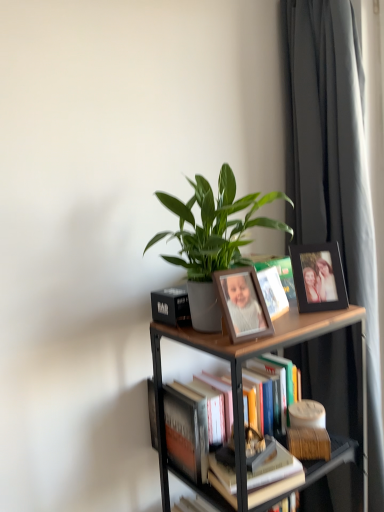
Question: From the image's perspective, is wooden photo frame at center, which appears as the 2th picture frame when viewed from the back, above green matte plant at center?

Choices:
 (A) yes
 (B) no

Answer: (B)

Question: From a real-world perspective, is wooden photo frame at center, which is the second picture frame from right to left, positioned under green matte plant at center based on gravity?

Choices:
 (A) no
 (B) yes

Answer: (B)

Question: Considering the relative sizes of wooden photo frame at center, which is the second picture frame from right to left, and green matte plant at center in the image provided, is wooden photo frame at center, which is the second picture frame from right to left, bigger than green matte plant at center?

Choices:
 (A) no
 (B) yes

Answer: (A)

Question: Is wooden photo frame at center, which appears as the 2th picture frame when viewed from the back, not near green matte plant at center?

Choices:
 (A) yes
 (B) no

Answer: (B)

Question: Is wooden photo frame at center, which ranks as the first picture frame in left-to-right order, at the left side of green matte plant at center?

Choices:
 (A) yes
 (B) no

Answer: (B)

Question: Is wooden photo frame at center, which is the second picture frame from right to left, in contact with green matte plant at center?

Choices:
 (A) no
 (B) yes

Answer: (A)

Question: Can we say black matte picture frame at upper right, marked as the second picture frame in a front-to-back arrangement, lies outside matte white book at center?

Choices:
 (A) yes
 (B) no

Answer: (A)

Question: Considering the relative positions of black matte picture frame at upper right, marked as the second picture frame in a front-to-back arrangement, and matte white book at center in the image provided, is black matte picture frame at upper right, marked as the second picture frame in a front-to-back arrangement, behind matte white book at center?

Choices:
 (A) yes
 (B) no

Answer: (A)

Question: Considering the relative sizes of black matte picture frame at upper right, marked as the second picture frame in a front-to-back arrangement, and matte white book at center in the image provided, is black matte picture frame at upper right, marked as the second picture frame in a front-to-back arrangement, shorter than matte white book at center?

Choices:
 (A) yes
 (B) no

Answer: (B)

Question: From the image's perspective, is black matte picture frame at upper right, marked as the second picture frame in a front-to-back arrangement, located above matte white book at center?

Choices:
 (A) yes
 (B) no

Answer: (A)

Question: Can you confirm if black matte picture frame at upper right, positioned as the 1th picture frame in right-to-left order, is wider than matte white book at center?

Choices:
 (A) yes
 (B) no

Answer: (A)

Question: Considering the relative sizes of black matte picture frame at upper right, which is counted as the 2th picture frame, starting from the left, and matte white book at center in the image provided, is black matte picture frame at upper right, which is counted as the 2th picture frame, starting from the left, smaller than matte white book at center?

Choices:
 (A) no
 (B) yes

Answer: (A)

Question: Is hardcover book at center, which is counted as the second book, starting from the back, taller than hardcover books at center, the 2th book when ordered from front to back?

Choices:
 (A) no
 (B) yes

Answer: (A)